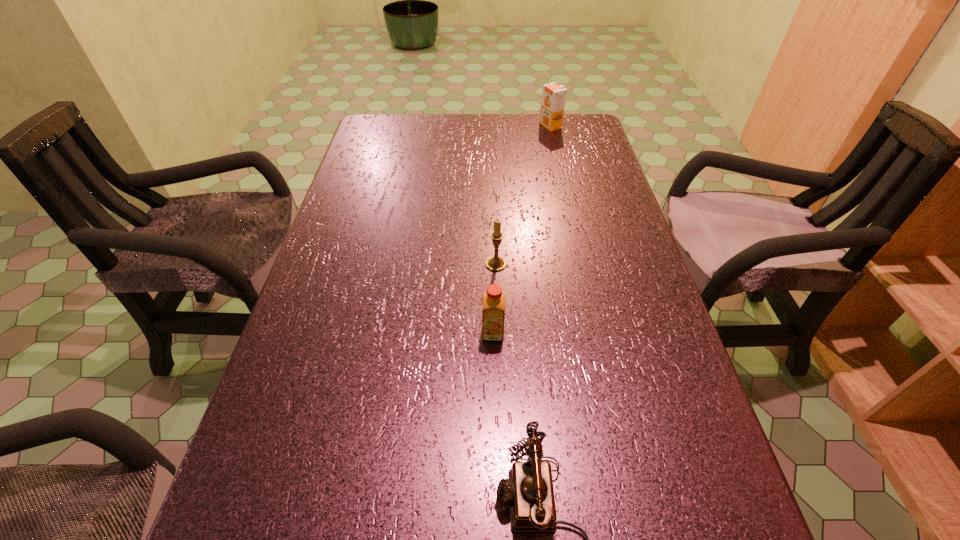
Where is `the farthest object`? The height and width of the screenshot is (540, 960). the farthest object is located at coordinates (553, 95).

Locate an element on the screen. the right orange juice is located at coordinates (553, 95).

This screenshot has width=960, height=540. In order to click on the second farthest object in this screenshot , I will do `click(494, 263)`.

Where is `the nearer orange juice`? This screenshot has height=540, width=960. the nearer orange juice is located at coordinates (493, 300).

Image resolution: width=960 pixels, height=540 pixels. I want to click on the third farthest object, so click(493, 300).

This screenshot has height=540, width=960. Identify the location of free space located 0.190m on the left of the right orange juice. (484, 126).

The image size is (960, 540). In order to click on free space located 0.130m on the front of the candle holder in this screenshot , I will do `click(497, 315)`.

You are a GUI agent. You are given a task and a screenshot of the screen. Output one action in this format:
    pyautogui.click(x=<x>, y=<y>)
    Task: Click on the vacant space positioned on the front and back of the second nearest object
    The width and height of the screenshot is (960, 540).
    Given the screenshot: What is the action you would take?
    pyautogui.click(x=496, y=478)

Identify the location of object that is at the far edge. (553, 95).

Identify the location of object that is at the right edge. (553, 95).